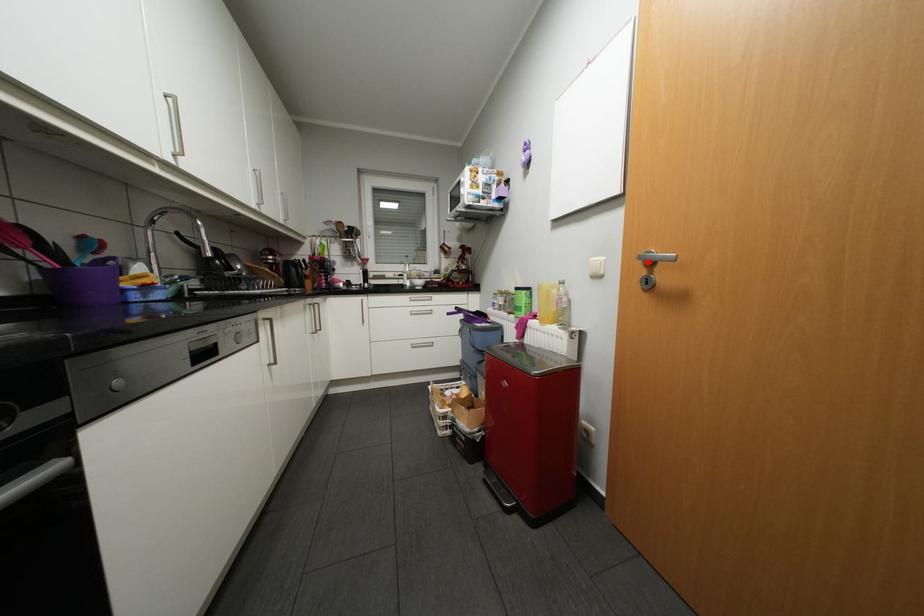
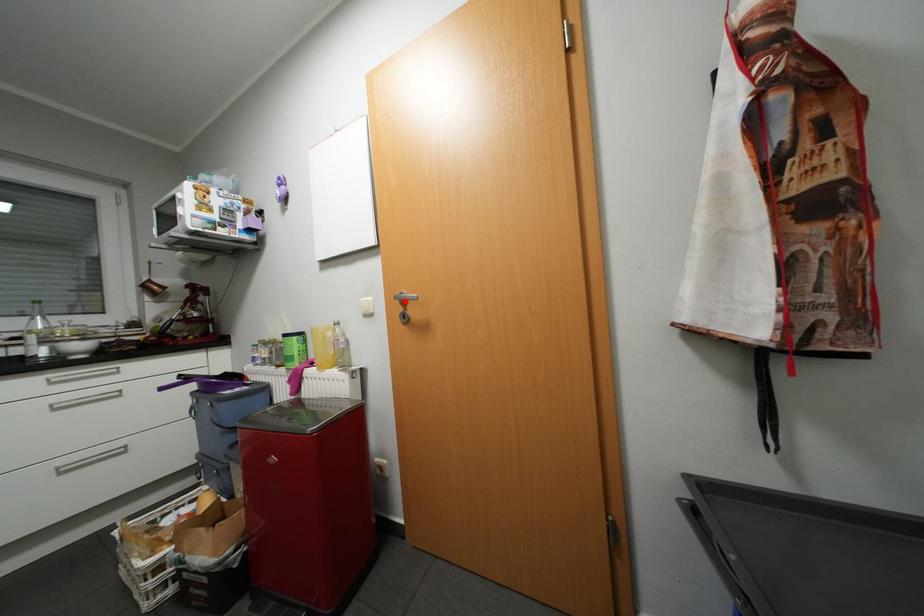
I am providing you with two images of the same scene from different viewpoints. A red point is marked on the first image and another point is marked on the second image. Does the point marked in image1 correspond to the same location as the one in image2?

Yes